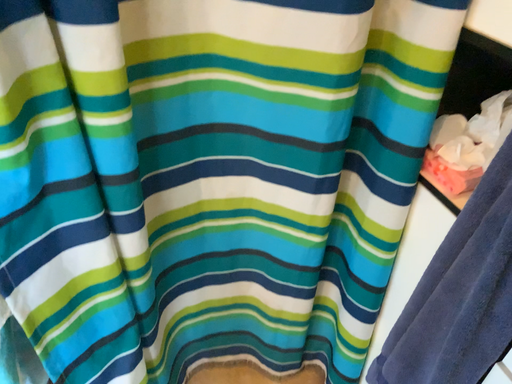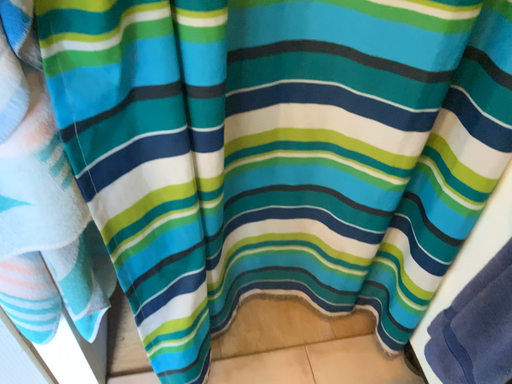
Question: Which way did the camera rotate in the video?

Choices:
 (A) rotated downward
 (B) rotated upward

Answer: (A)